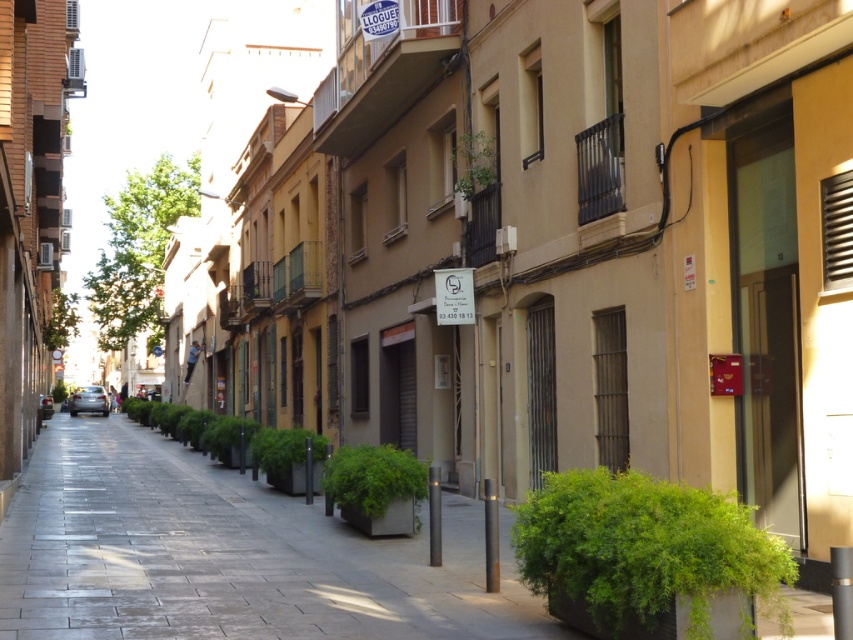
You are a delivery person with a cart that is 2 meters wide. You need to move from the green leafy planter at center to the green leafy plant at upper center along the street. Can your cart fit through the space between them?

The distance between the green leafy planter at center and the green leafy plant at upper center is 4.56 meters. Since the cart is 2 meters wide, it can easily fit through the space between them as the distance is more than sufficient.

You are standing on the narrow urban street and want to place a small bench next to the green leafy plant at center. According to the scene description, where should the bench be placed relative to the plant?

The bench should be placed next to the green leafy plant at center, which is located at point (643, 548) in the scene.